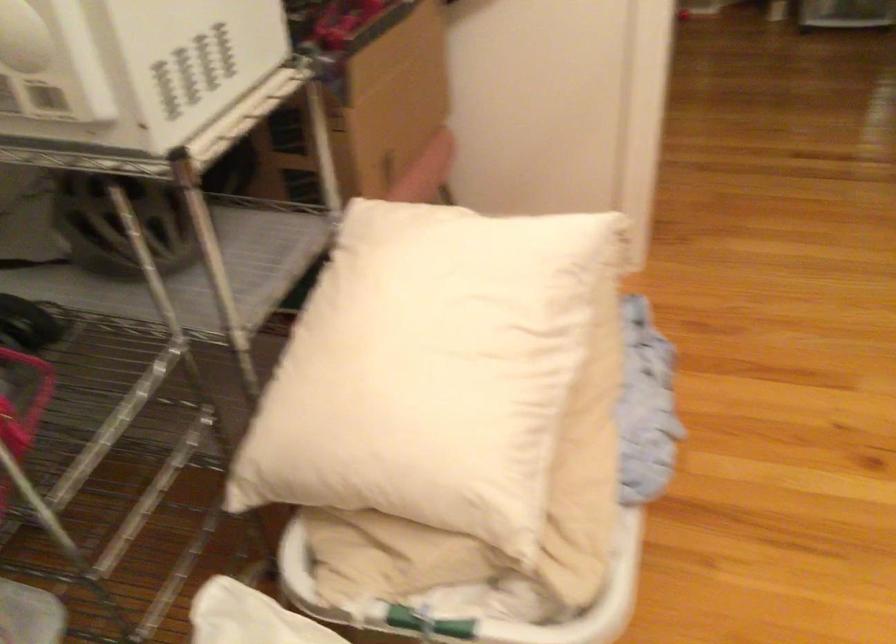
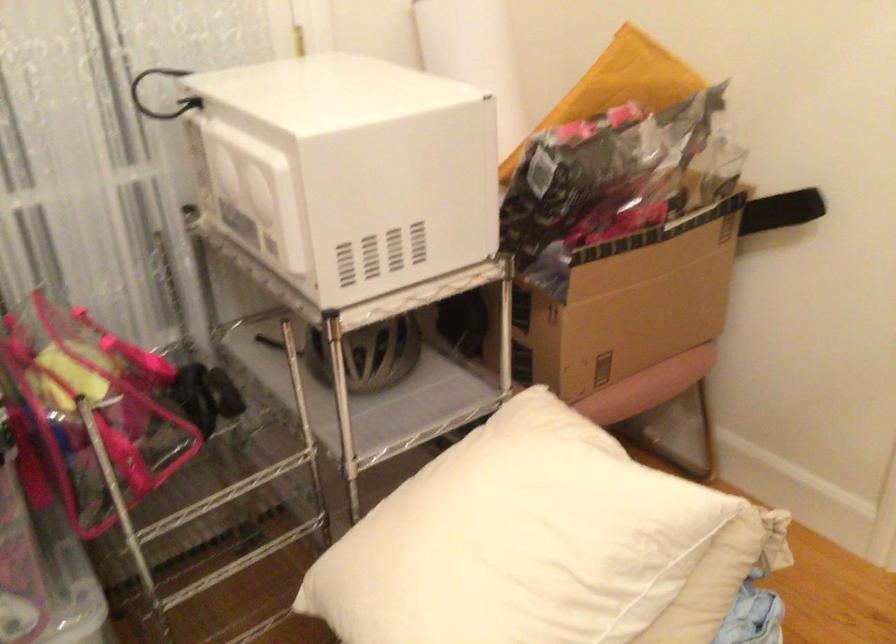
The point at (179, 222) is marked in the first image. Where is the corresponding point in the second image?

(375, 355)